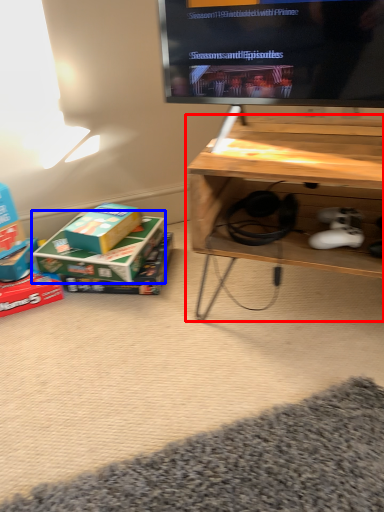
Question: Which object is closer to the camera taking this photo, table (highlighted by a red box) or box (highlighted by a blue box)?

Choices:
 (A) table
 (B) box

Answer: (A)